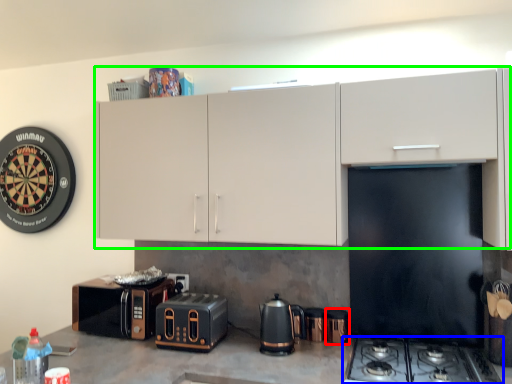
Question: Which is farther away from appliance (highlighted by a red box)? gas stove (highlighted by a blue box) or cabinetry (highlighted by a green box)?

Choices:
 (A) gas stove
 (B) cabinetry

Answer: (B)